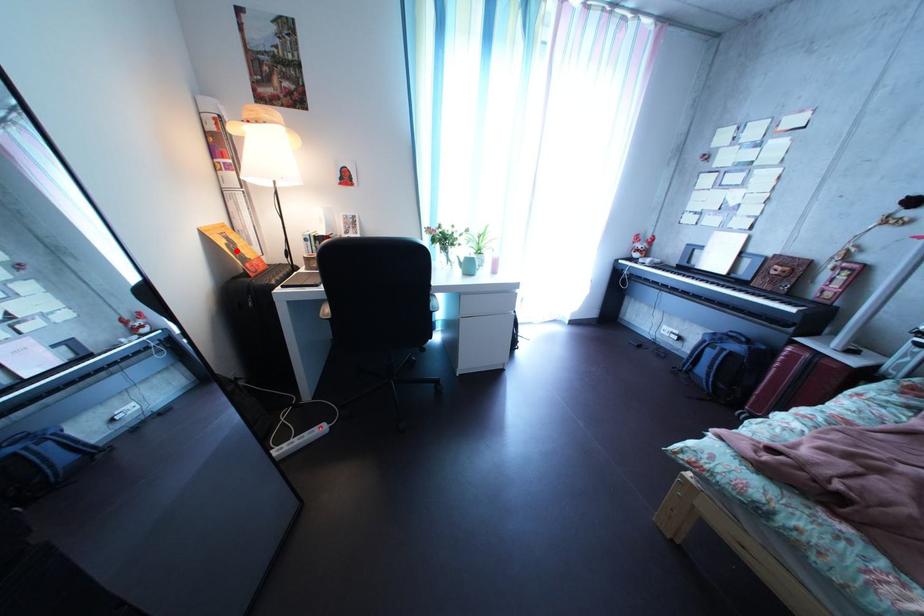
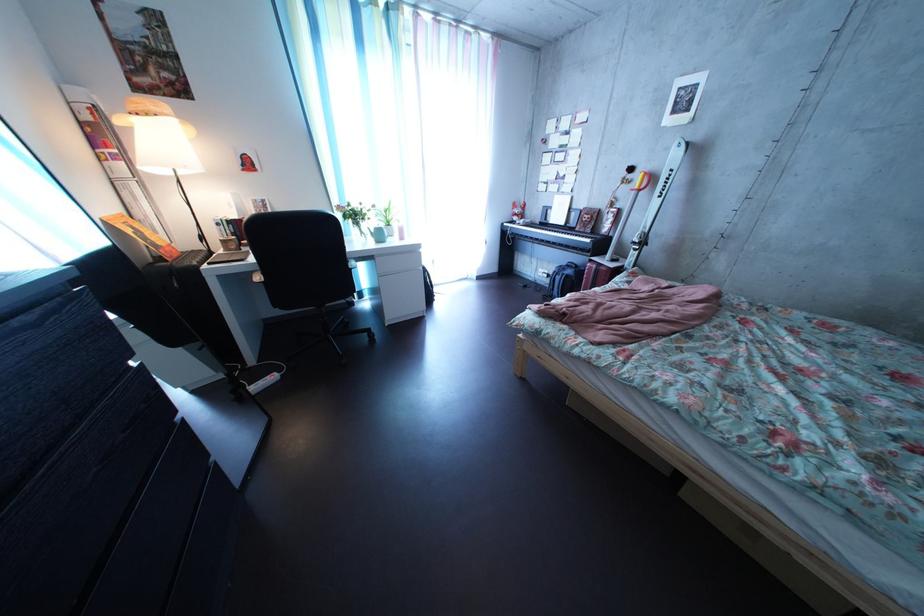
The point at the highlighted location is marked in the first image. Where is the corresponding point in the second image?

(142, 238)